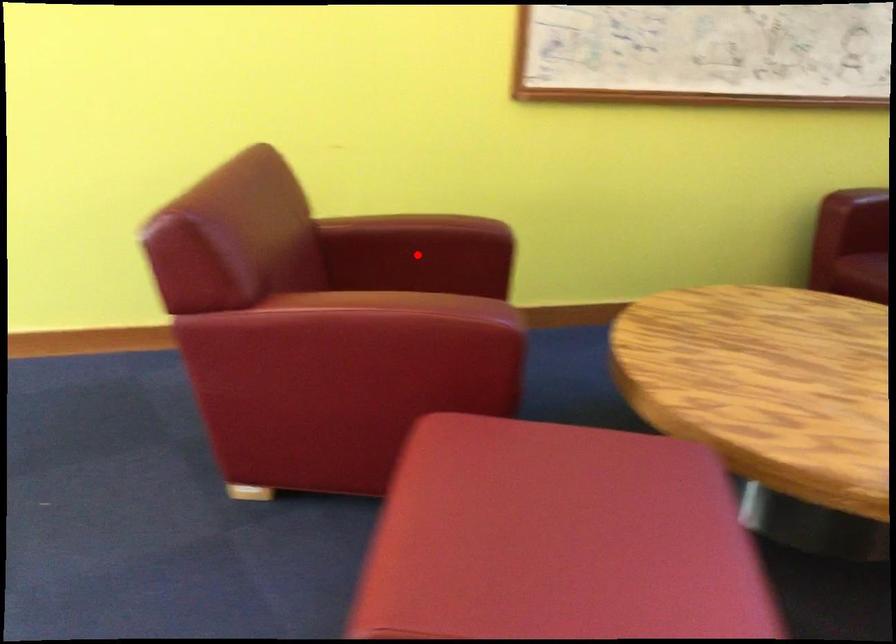
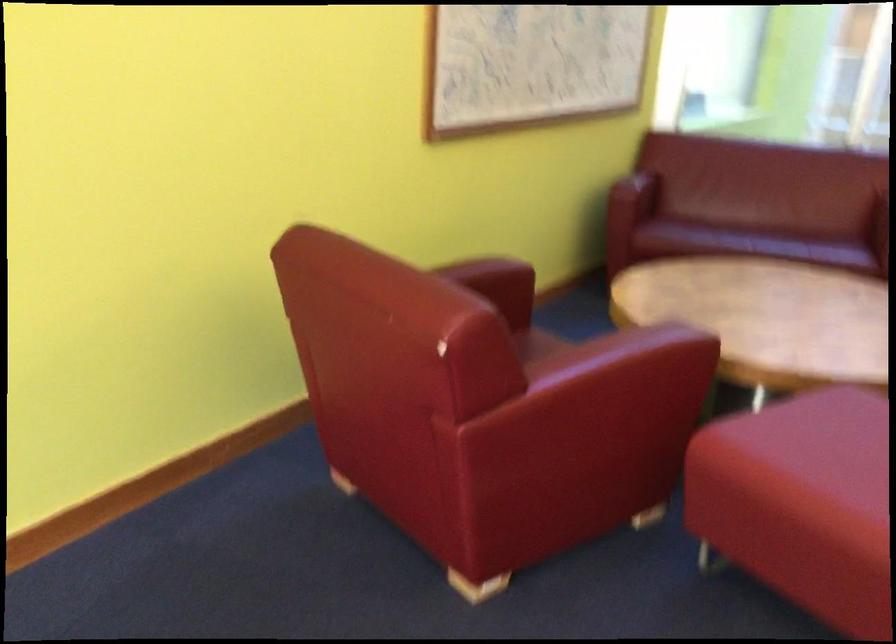
Question: I am providing you with two images of the same scene from different viewpoints. A red point is marked on the first image. Is the red point's position out of view in image 2?

Choices:
 (A) Yes
 (B) No

Answer: (A)